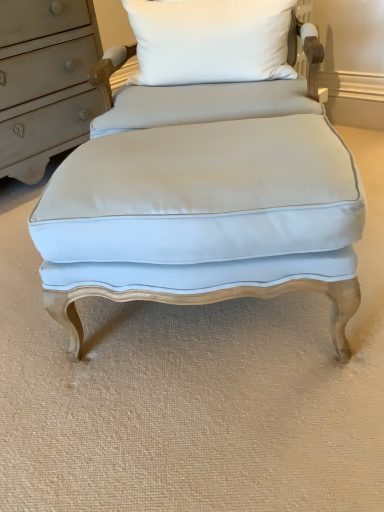
Question: In the image, is light blue fabric ottoman at center positioned in front of or behind white fabric pillow at upper center?

Choices:
 (A) behind
 (B) front

Answer: (B)

Question: From a real-world perspective, is light blue fabric ottoman at center physically located above or below white fabric pillow at upper center?

Choices:
 (A) above
 (B) below

Answer: (B)

Question: From the image's perspective, relative to white fabric pillow at upper center, is light blue fabric ottoman at center above or below?

Choices:
 (A) below
 (B) above

Answer: (A)

Question: Is white fabric pillow at upper center to the left or to the right of light blue fabric ottoman at center in the image?

Choices:
 (A) right
 (B) left

Answer: (A)

Question: Is white fabric pillow at upper center spatially inside light blue fabric ottoman at center, or outside of it?

Choices:
 (A) inside
 (B) outside

Answer: (B)

Question: Considering the positions of white fabric pillow at upper center and light blue fabric ottoman at center in the image, is white fabric pillow at upper center bigger or smaller than light blue fabric ottoman at center?

Choices:
 (A) small
 (B) big

Answer: (A)

Question: Does point (226, 4) appear closer or farther from the camera than point (235, 126)?

Choices:
 (A) closer
 (B) farther

Answer: (B)